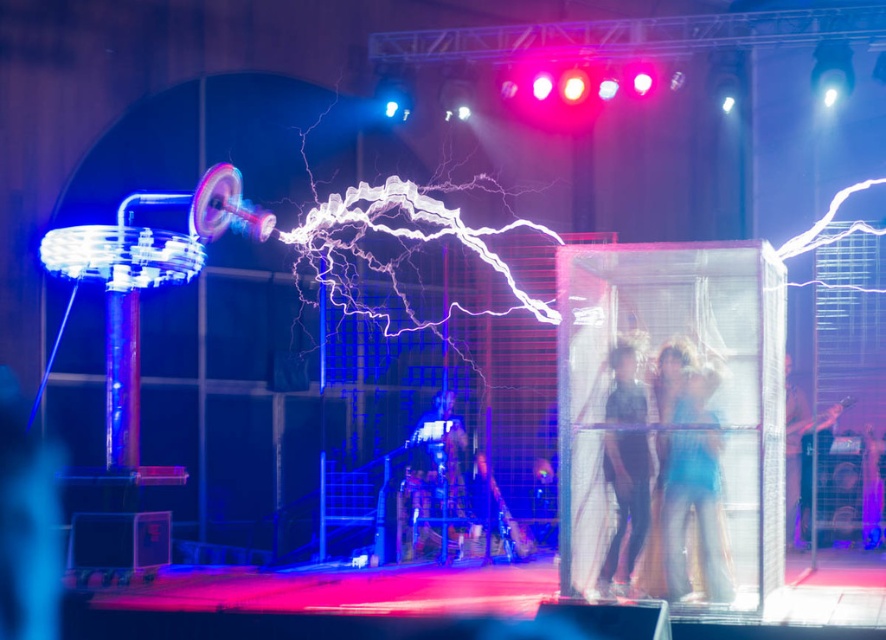
You are an event photographer positioned at the front of the stage. You want to capture a close shot of the Tesla coil. Which of the two points, point (672, 401) or point (795, 388), is closer to you?

Point (672, 401) is closer to the viewer than point (795, 388), so you should focus on that point for your close shot.